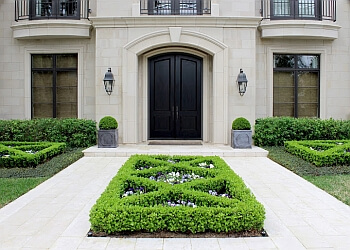
Find the location of a particular element. The image size is (350, 250). left door handle is located at coordinates coord(172,113).